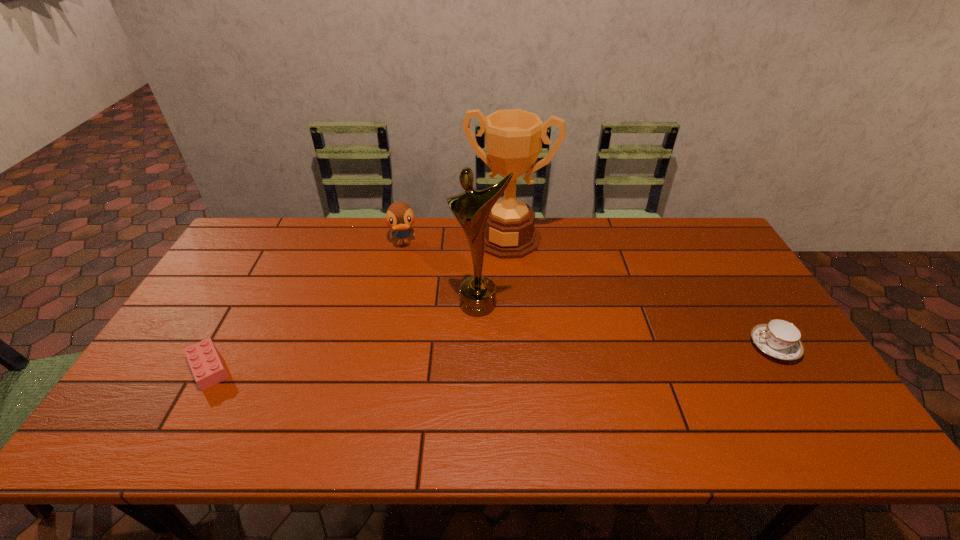
Where is `vacant space at the right edge of the desktop`? This screenshot has height=540, width=960. vacant space at the right edge of the desktop is located at coordinates (789, 373).

You are a GUI agent. You are given a task and a screenshot of the screen. Output one action in this format:
    pyautogui.click(x=<x>, y=<y>)
    Task: Click on the blank area at the far left corner
    
    Given the screenshot: What is the action you would take?
    pyautogui.click(x=277, y=234)

Image resolution: width=960 pixels, height=540 pixels. Identify the location of vacant region between the third tallest object and the rightmost object. (588, 295).

This screenshot has height=540, width=960. In order to click on free space between the rightmost object and the nearer award in this screenshot , I will do `click(626, 325)`.

Find the location of `vacant area that lies between the teacup and the farther award`. vacant area that lies between the teacup and the farther award is located at coordinates (640, 293).

At what (x,y) coordinates should I click in order to perform the action: click on vacant space in between the third tallest object and the nearer award. Please return your answer as a coordinate pair (x, y). The width and height of the screenshot is (960, 540). Looking at the image, I should click on (441, 274).

What are the coordinates of `unoccupied area between the nearer award and the rightmost object` in the screenshot? It's located at (626, 325).

Identify the location of free point between the farther award and the leftmost object. (358, 303).

Locate an element on the screen. The image size is (960, 540). free space between the farther award and the leftmost object is located at coordinates (358, 303).

You are a GUI agent. You are given a task and a screenshot of the screen. Output one action in this format:
    pyautogui.click(x=<x>, y=<y>)
    Task: Click on the free space between the leftmost object and the farther award
    This screenshot has height=540, width=960.
    Given the screenshot: What is the action you would take?
    pyautogui.click(x=358, y=303)